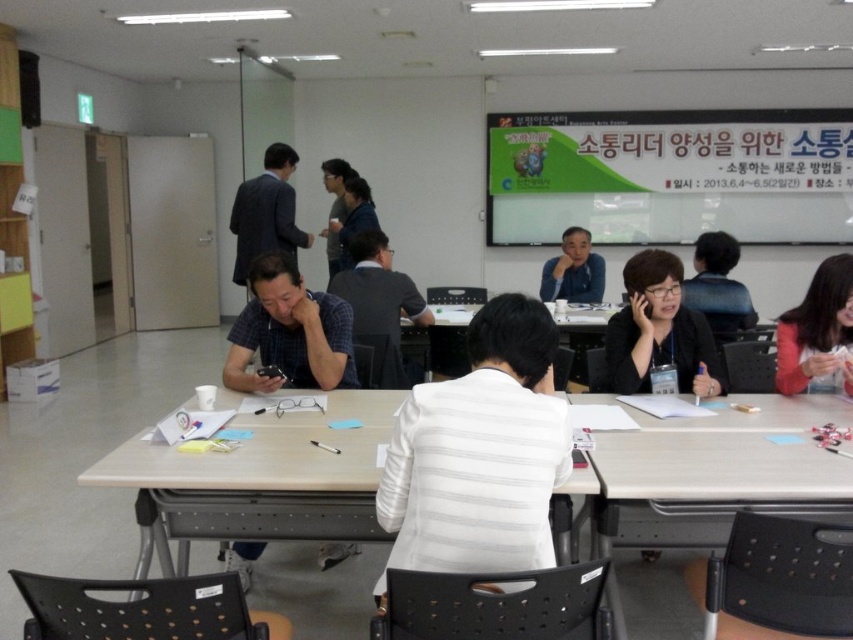
Question: Does black matte jacket at center come behind matte blue shirt at center?

Choices:
 (A) no
 (B) yes

Answer: (A)

Question: Is dark gray suit at center to the left of black matte jacket at center from the viewer's perspective?

Choices:
 (A) yes
 (B) no

Answer: (A)

Question: Observing the image, what is the correct spatial positioning of blue plaid shirt at center in reference to matte black jacket at lower right?

Choices:
 (A) below
 (B) above

Answer: (A)

Question: Estimate the real-world distances between objects in this image. Which object is closer to the black glossy hair at center?

Choices:
 (A) green matte poster at upper center
 (B) blue fabric shirt at center
 (C) blue plaid shirt at center

Answer: (C)

Question: Considering the real-world distances, which object is farthest from the white striped blazer at center?

Choices:
 (A) dark blue shirt at center
 (B) green matte poster at upper center
 (C) light brown wooden table at center

Answer: (B)

Question: Which object is the farthest from the white striped blazer at center?

Choices:
 (A) light brown wooden table at center
 (B) matte black jacket at lower right

Answer: (B)